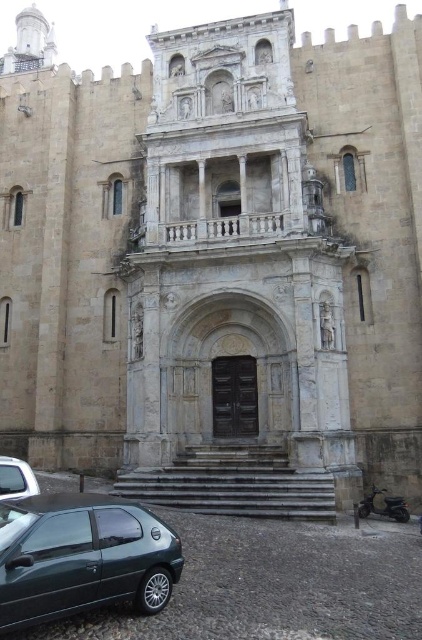
Who is lower down, metallic green hatchback at lower left or silver metallic car at lower left?

silver metallic car at lower left is below.

Who is more forward, (10, 588) or (26, 461)?

Point (10, 588)

This screenshot has width=422, height=640. I want to click on metallic green hatchback at lower left, so click(81, 556).